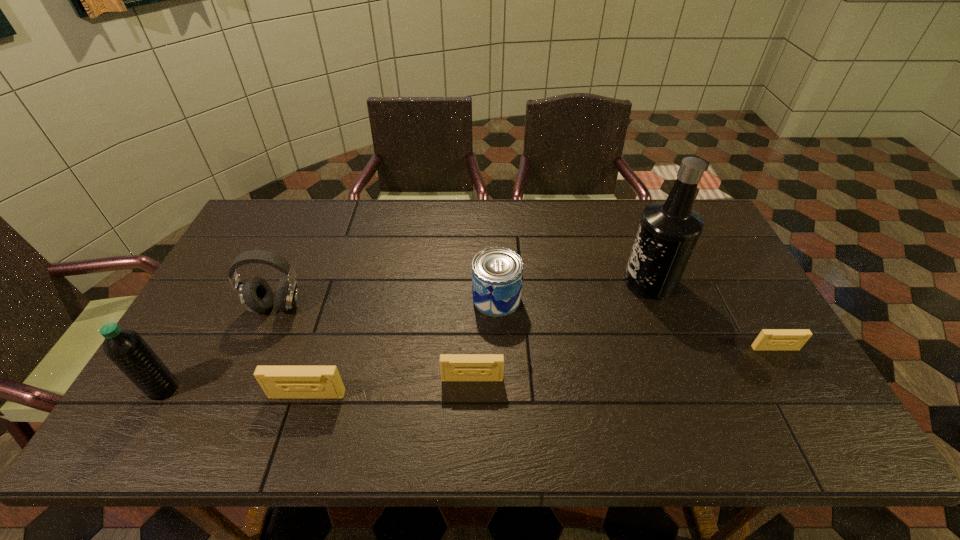
Find the location of a particular element. vacant space situated 0.200m on the front label of the fourth tallest object is located at coordinates point(403,298).

In order to click on vacant region located on the right of the second tallest object in this screenshot , I will do `click(281, 389)`.

This screenshot has width=960, height=540. What are the coordinates of `water bottle that is at the near edge` in the screenshot? It's located at (126, 348).

This screenshot has width=960, height=540. Find the location of `headset that is at the left edge`. headset that is at the left edge is located at coordinates (256, 295).

Where is `water bottle located in the left edge section of the desktop`? The width and height of the screenshot is (960, 540). water bottle located in the left edge section of the desktop is located at coordinates (126, 348).

This screenshot has width=960, height=540. What are the coordinates of `object present at the right edge` in the screenshot? It's located at (768, 339).

The image size is (960, 540). Find the location of `object at the near left corner`. object at the near left corner is located at coordinates (126, 348).

I want to click on free space at the far edge, so 571,228.

In the image, there is a desktop. At what (x,y) coordinates should I click in order to perform the action: click on vacant space at the near edge. Please return your answer as a coordinate pair (x, y). The width and height of the screenshot is (960, 540). Looking at the image, I should click on (717, 396).

Locate an element on the screen. This screenshot has height=540, width=960. blank space at the left edge of the desktop is located at coordinates (241, 251).